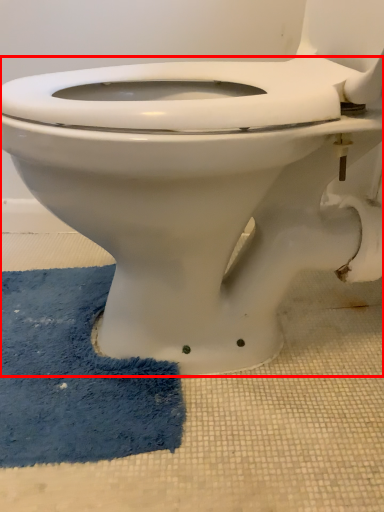
Question: In this image, where is toilet (annotated by the red box) located relative to bath mat?

Choices:
 (A) left
 (B) right

Answer: (B)